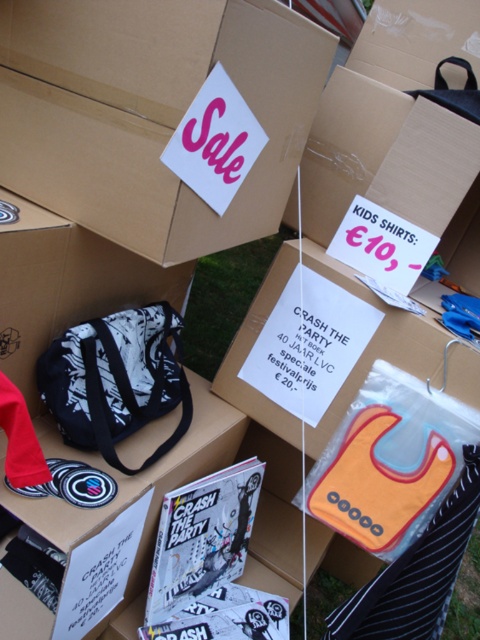
Question: Can you confirm if matte cardboard box at upper center is thinner than orange fabric bib at lower right?

Choices:
 (A) yes
 (B) no

Answer: (B)

Question: Can you confirm if matte cardboard box at upper center is bigger than orange fabric bib at lower right?

Choices:
 (A) no
 (B) yes

Answer: (B)

Question: Which object is positioned farthest from the black and white fabric bag at center?

Choices:
 (A) orange fabric bib at lower right
 (B) matte cardboard box at upper center

Answer: (A)

Question: Which point is closer to the camera?

Choices:
 (A) matte cardboard box at upper center
 (B) orange fabric bib at lower right
 (C) black and white fabric bag at center

Answer: (A)

Question: Which object is closer to the camera taking this photo?

Choices:
 (A) orange fabric bib at lower right
 (B) black and white fabric bag at center
 (C) matte cardboard box at upper center

Answer: (C)

Question: Can you confirm if matte cardboard box at upper center is smaller than orange fabric bib at lower right?

Choices:
 (A) yes
 (B) no

Answer: (B)